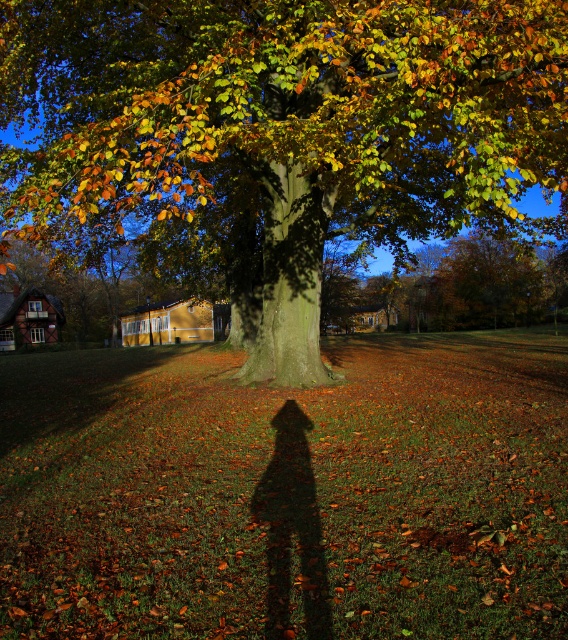
Question: Can you confirm if green rough bark tree at center is wider than green leafy tree at upper center?

Choices:
 (A) no
 (B) yes

Answer: (A)

Question: Is the position of green rough bark tree at center more distant than that of green leafy tree at upper center?

Choices:
 (A) yes
 (B) no

Answer: (B)

Question: Which object appears farthest from the camera in this image?

Choices:
 (A) green leafy tree at upper center
 (B) green rough bark tree at center

Answer: (A)

Question: Which point is closer to the camera?

Choices:
 (A) (509, 83)
 (B) (473, 237)

Answer: (A)

Question: Does green rough bark tree at center lie in front of green leafy tree at upper center?

Choices:
 (A) no
 (B) yes

Answer: (B)